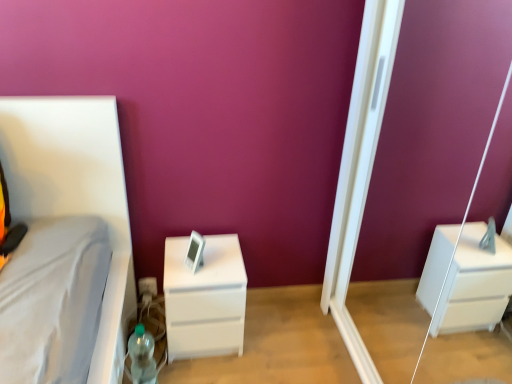
Where is `blank space situated above white matte chest of drawers at center (from a real-world perspective)`? Image resolution: width=512 pixels, height=384 pixels. blank space situated above white matte chest of drawers at center (from a real-world perspective) is located at coordinates (212, 263).